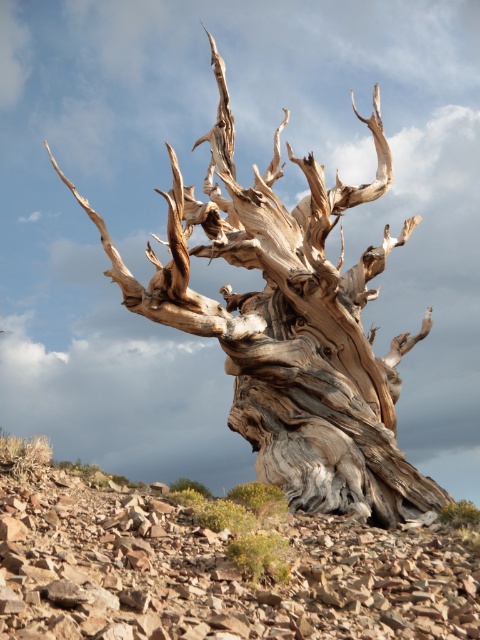
Which is behind, point (224, 74) or point (186, 484)?

The point (224, 74) is behind.

In the scene shown: Is gray textured wood at center to the right of gray rough bark tree at lower center from the viewer's perspective?

Yes, gray textured wood at center is to the right of gray rough bark tree at lower center.

Does point (394, 349) lie behind point (203, 493)?

That is True.

Where is `gray textured wood at center`? gray textured wood at center is located at coordinates (290, 324).